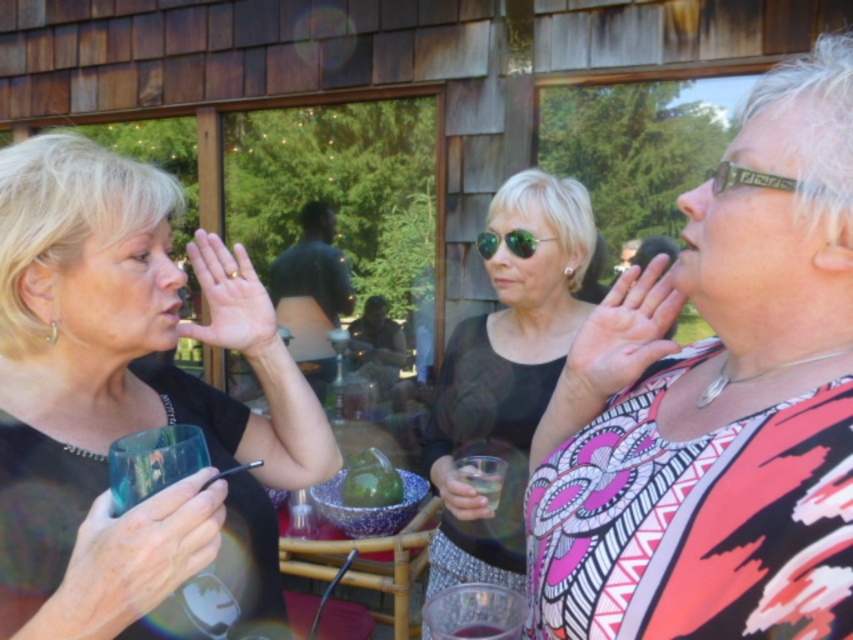
Question: Among these objects, which one is farthest from the camera?

Choices:
 (A) matte black dress at center
 (B) matte black shirt at left

Answer: (A)

Question: Does clear plastic cup at center appear over green reflective sunglasses at center?

Choices:
 (A) no
 (B) yes

Answer: (A)

Question: Does printed fabric blouse at center appear under green reflective sunglasses at center?

Choices:
 (A) no
 (B) yes

Answer: (B)

Question: Does printed fabric blouse at center lie in front of green reflective sunglasses at center?

Choices:
 (A) no
 (B) yes

Answer: (B)

Question: Estimate the real-world distances between objects in this image. Which object is farther from the green reflective sunglasses at center?

Choices:
 (A) translucent glass at lower center
 (B) matte black dress at center
 (C) clear plastic cup at center
 (D) printed fabric blouse at center

Answer: (A)

Question: Which object is positioned closest to the clear plastic cup at center?

Choices:
 (A) matte black shirt at left
 (B) printed fabric blouse at center

Answer: (A)